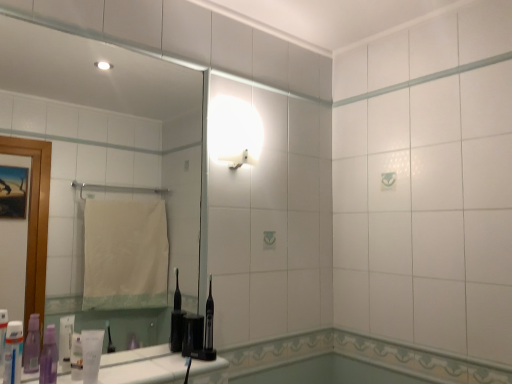
Question: Is translucent plastic toothpaste tube at lower left, the 4th toiletry viewed from the right, oriented away from white glossy light fixture at upper center?

Choices:
 (A) no
 (B) yes

Answer: (A)

Question: Considering the relative positions of translucent plastic toothpaste tube at lower left, the first toiletry in the left-to-right sequence, and white glossy light fixture at upper center in the image provided, is translucent plastic toothpaste tube at lower left, the first toiletry in the left-to-right sequence, to the left of white glossy light fixture at upper center from the viewer's perspective?

Choices:
 (A) no
 (B) yes

Answer: (B)

Question: From the image's perspective, does translucent plastic toothpaste tube at lower left, the 4th toiletry viewed from the right, appear lower than white glossy light fixture at upper center?

Choices:
 (A) yes
 (B) no

Answer: (A)

Question: From the image's perspective, does translucent plastic toothpaste tube at lower left, the 4th toiletry viewed from the right, appear higher than white glossy light fixture at upper center?

Choices:
 (A) no
 (B) yes

Answer: (A)

Question: Considering the relative sizes of translucent plastic toothpaste tube at lower left, the first toiletry in the left-to-right sequence, and white glossy light fixture at upper center in the image provided, is translucent plastic toothpaste tube at lower left, the first toiletry in the left-to-right sequence, shorter than white glossy light fixture at upper center?

Choices:
 (A) no
 (B) yes

Answer: (B)

Question: Would you say clear glass mirror at upper left is inside or outside translucent plastic toothpaste tube at lower left, the first toiletry in the left-to-right sequence?

Choices:
 (A) inside
 (B) outside

Answer: (B)

Question: Relative to translucent plastic toothpaste tube at lower left, the first toiletry in the left-to-right sequence, is clear glass mirror at upper left in front or behind?

Choices:
 (A) front
 (B) behind

Answer: (B)

Question: From a real-world perspective, relative to translucent plastic toothpaste tube at lower left, the 4th toiletry viewed from the right, is clear glass mirror at upper left vertically above or below?

Choices:
 (A) above
 (B) below

Answer: (A)

Question: Considering the relative positions of clear glass mirror at upper left and translucent plastic toothpaste tube at lower left, the first toiletry in the left-to-right sequence, in the image provided, is clear glass mirror at upper left to the left or to the right of translucent plastic toothpaste tube at lower left, the first toiletry in the left-to-right sequence,?

Choices:
 (A) left
 (B) right

Answer: (B)

Question: Is point (44, 350) closer or farther from the camera than point (74, 360)?

Choices:
 (A) closer
 (B) farther

Answer: (A)

Question: Considering their positions, is purple plastic toothpaste at lower left, the third toiletry in the right-to-left sequence, located in front of or behind translucent plastic toothpaste tube at lower left, marked as the third toiletry in a left-to-right arrangement?

Choices:
 (A) behind
 (B) front

Answer: (B)

Question: Is purple plastic toothpaste at lower left, the third toiletry in the right-to-left sequence, inside the boundaries of translucent plastic toothpaste tube at lower left, which is the second toiletry from right to left, or outside?

Choices:
 (A) outside
 (B) inside

Answer: (A)

Question: Looking at their shapes, would you say purple plastic toothpaste at lower left, the third toiletry in the right-to-left sequence, is wider or thinner than translucent plastic toothpaste tube at lower left, which is the second toiletry from right to left?

Choices:
 (A) wide
 (B) thin

Answer: (A)

Question: Is point (14, 364) closer or farther from the camera than point (242, 102)?

Choices:
 (A) closer
 (B) farther

Answer: (A)

Question: Is translucent plastic toothpaste tube at lower left, the 4th toiletry viewed from the right, wider or thinner than white glossy light fixture at upper center?

Choices:
 (A) wide
 (B) thin

Answer: (B)